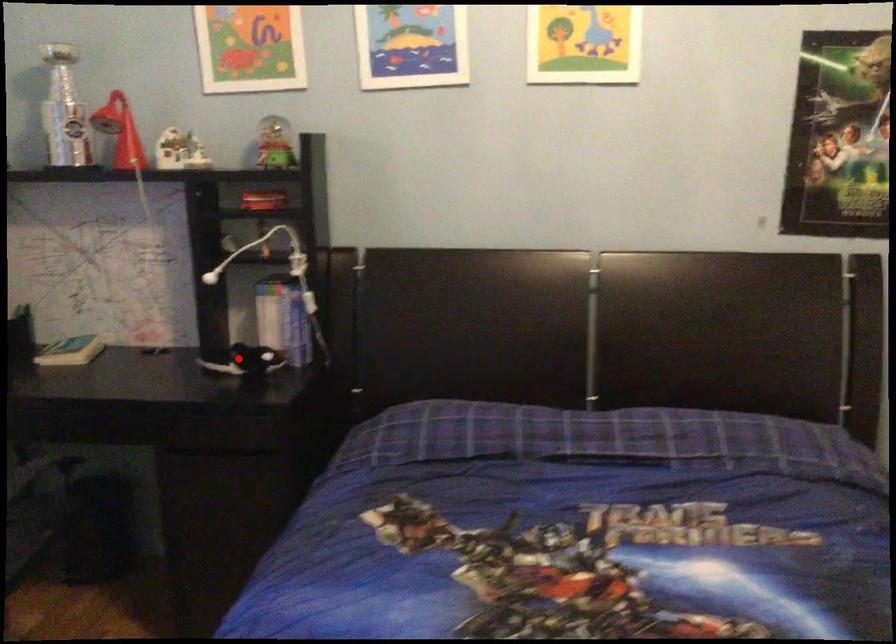
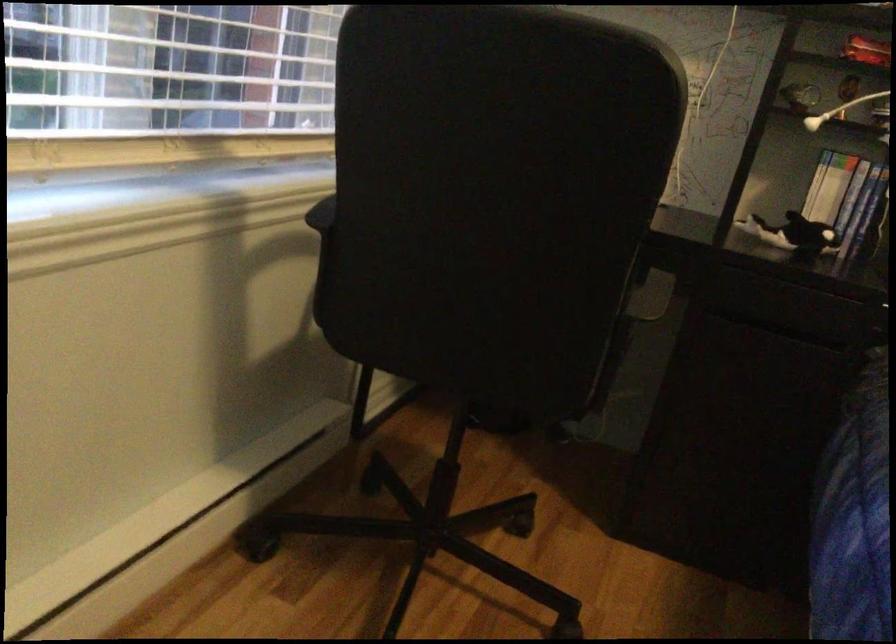
Find the pixel in the second image that matches the highlighted location in the first image.

(793, 234)